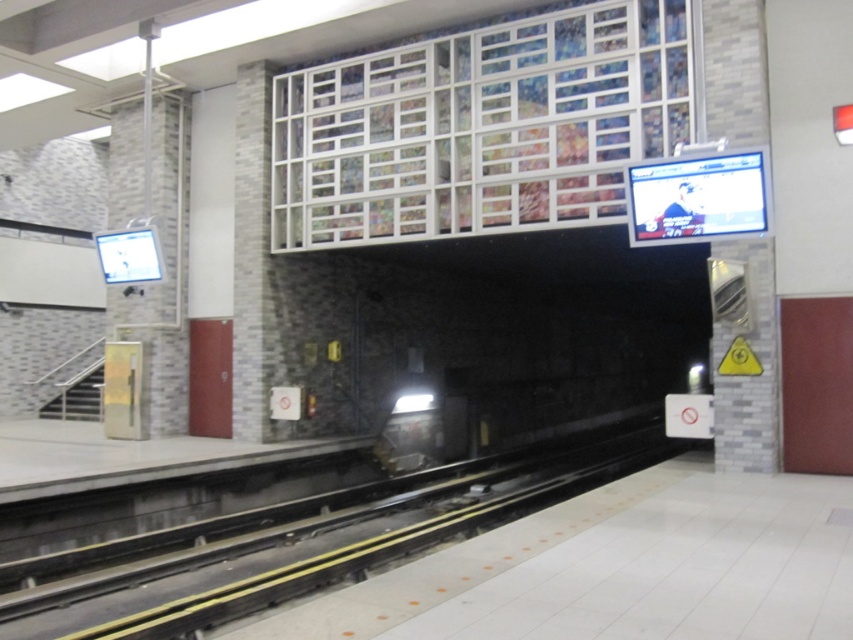
Question: Does black rubber train track at center come behind metallic gray train at center?

Choices:
 (A) no
 (B) yes

Answer: (A)

Question: Is black rubber train track at center thinner than metallic gray train at center?

Choices:
 (A) yes
 (B) no

Answer: (B)

Question: Is black rubber train track at center bigger than metallic gray train at center?

Choices:
 (A) no
 (B) yes

Answer: (A)

Question: Which point is farther to the camera?

Choices:
 (A) black rubber train track at center
 (B) metallic gray train at center

Answer: (B)

Question: Which object appears closest to the camera in this image?

Choices:
 (A) black rubber train track at center
 (B) metallic gray train at center

Answer: (A)